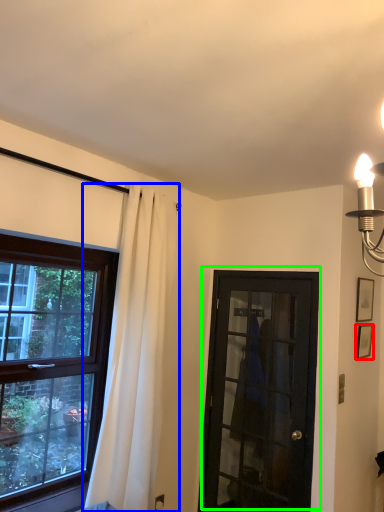
Question: Estimate the real-world distances between objects in this image. Which object is farther from picture frame (highlighted by a red box), curtain (highlighted by a blue box) or door (highlighted by a green box)?

Choices:
 (A) curtain
 (B) door

Answer: (A)